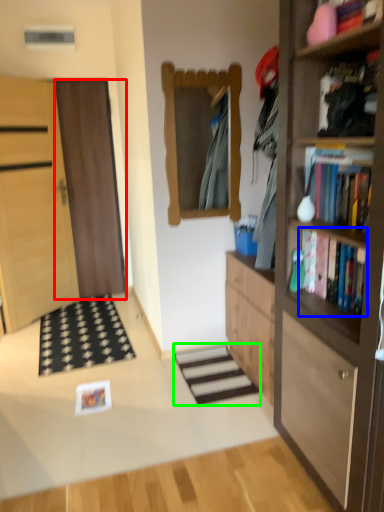
Question: Estimate the real-world distances between objects in this image. Which object is closer to door (highlighted by a red box), book (highlighted by a blue box) or stairwell (highlighted by a green box)?

Choices:
 (A) book
 (B) stairwell

Answer: (B)